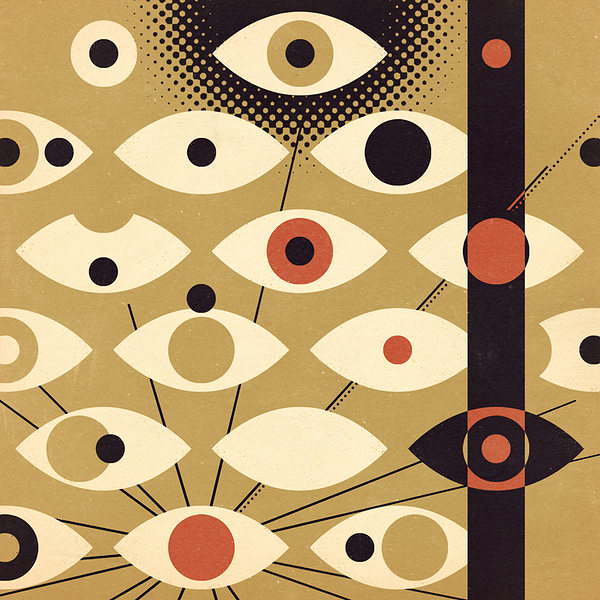
At what (x,y) coordinates should I click in order to perform the action: click on vertical black column. Please return your answer as a coordinate pair (x, y). The image size is (600, 600). Looking at the image, I should click on (502, 114).